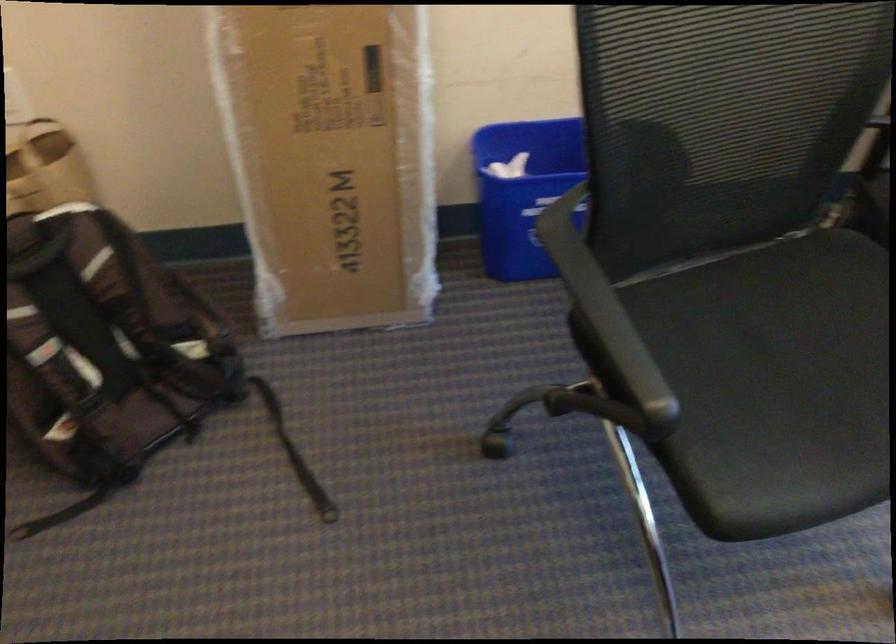
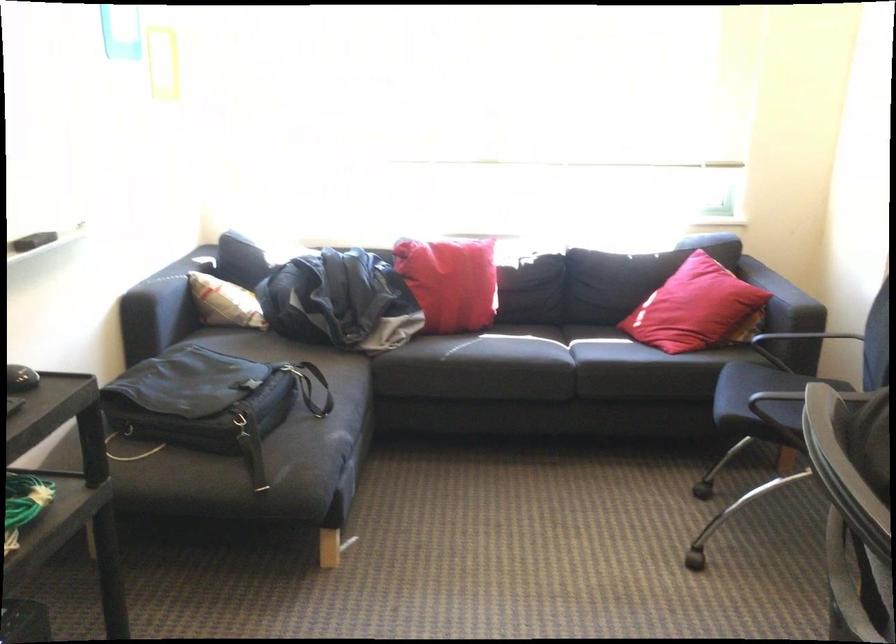
Question: The images are taken continuously from a first-person perspective. In which direction is your viewpoint rotating?

Choices:
 (A) Left
 (B) Right
 (C) Up
 (D) Down

Answer: (B)